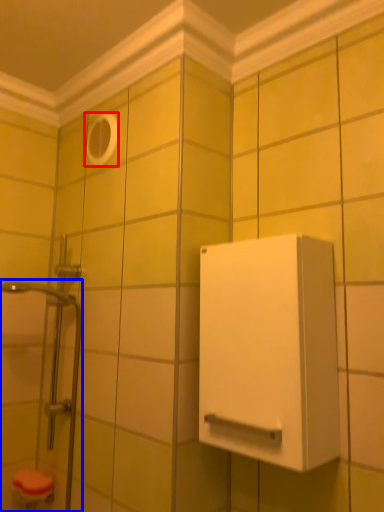
Question: Which point is closer to the camera, hole (highlighted by a red box) or shower door (highlighted by a blue box)?

Choices:
 (A) hole
 (B) shower door

Answer: (B)